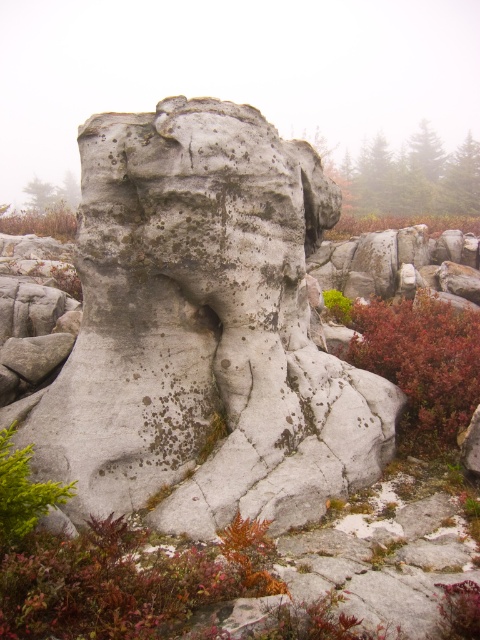
Can you confirm if leathery red shrub at center right is bigger than leathery brown shrub at center?

Actually, leathery red shrub at center right might be smaller than leathery brown shrub at center.

Image resolution: width=480 pixels, height=640 pixels. What do you see at coordinates (421, 364) in the screenshot?
I see `leathery red shrub at center right` at bounding box center [421, 364].

Is point (464, 413) positioned before point (443, 227)?

Yes, it is.

The width and height of the screenshot is (480, 640). Find the location of `leathery red shrub at center right`. leathery red shrub at center right is located at coordinates (421, 364).

Is point (2, 520) positioned after point (1, 221)?

No, (2, 520) is in front of (1, 221).

Is green leafy plant at lower left positioned before green leafy plant at left?

Yes, it is.

What do you see at coordinates (23, 490) in the screenshot? I see `green leafy plant at lower left` at bounding box center [23, 490].

Where is `green leafy plant at lower left`? The width and height of the screenshot is (480, 640). green leafy plant at lower left is located at coordinates (23, 490).

Can you confirm if green leafy plant at lower left is smaller than leathery brown shrub at center?

Indeed, green leafy plant at lower left has a smaller size compared to leathery brown shrub at center.

I want to click on green leafy plant at lower left, so click(x=23, y=490).

What are the coordinates of `green leafy plant at lower left` in the screenshot? It's located at (23, 490).